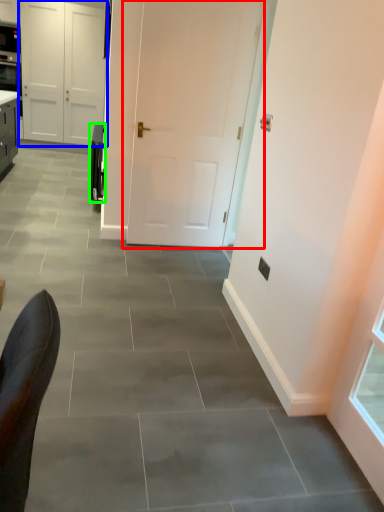
Question: Which is nearer to the door (highlighted by a red box)? door (highlighted by a blue box) or appliance (highlighted by a green box).

Choices:
 (A) door
 (B) appliance

Answer: (B)